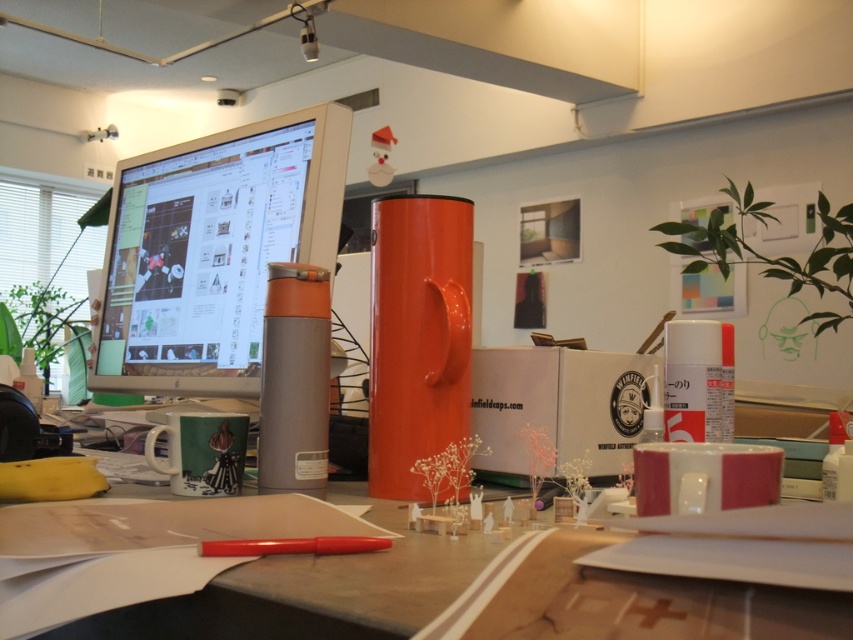
Does satin silver monitor at upper left appear under matte plastic desk at center?

Actually, satin silver monitor at upper left is above matte plastic desk at center.

Is satin silver monitor at upper left thinner than matte plastic desk at center?

No, satin silver monitor at upper left is not thinner than matte plastic desk at center.

Between point (187, 356) and point (315, 595), which one is positioned behind?

The point (187, 356) is behind.

In order to click on satin silver monitor at upper left in this screenshot , I will do `click(210, 250)`.